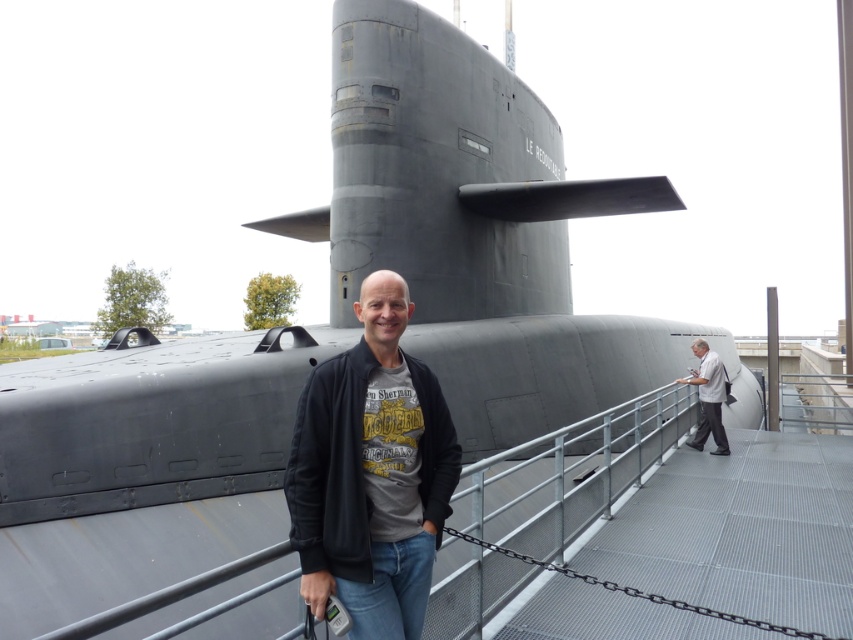
Consider the image. You are taking a photo of the submarine LE REDOUTABLE from the dock. You notice two points marked on your camera screen at coordinates point (405, 525) and point (717, 448). Which point is closer to your camera lens?

Point (405, 525) is closer to the camera lens than point (717, 448).

You are standing on the metal deck and want to take a photo of the submarine LE REDOUTABLE. The submarine is at point (x=326, y=492). If your camera has a focal length of 50mm and you want to capture the entire submarine in one shot, what is the minimum distance you should maintain from the submarine to ensure it fits within a 35mm film frame?

The minimum distance required would be calculated using the formula distance > focal length x object size in mm. However, without knowing the actual size of the submarine, we cannot compute an exact value. The submarine is at point (x=326, y=492), so ensure you position yourself appropriately based on its dimensions.

You are a photographer trying to capture the submarine LE REDOUTABLE from the dock. You notice a point marked at coordinates (x=370, y=472) in your viewfinder. What object is located at that point?

The point at coordinates (x=370, y=472) corresponds to the black matte jacket at center.